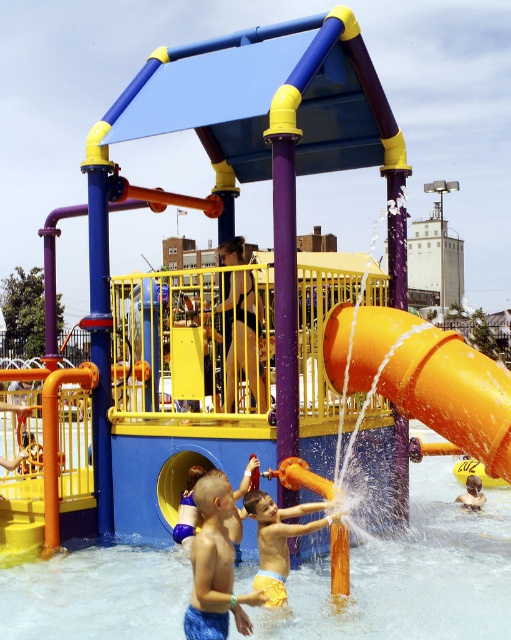
You are a parent watching your children play at the water park. You see the orange matte water at center and the orange matte slide at center. Which one is located to the right of the other?

The orange matte water at center is positioned on the right side of orange matte slide at center.

You are a parent trying to decide which toy to give to your child at the water park. You see the orange matte slide at center and the smooth yellow rubber duck at lower center. Which toy is taller?

The smooth yellow rubber duck at lower center is taller than the orange matte slide at center.